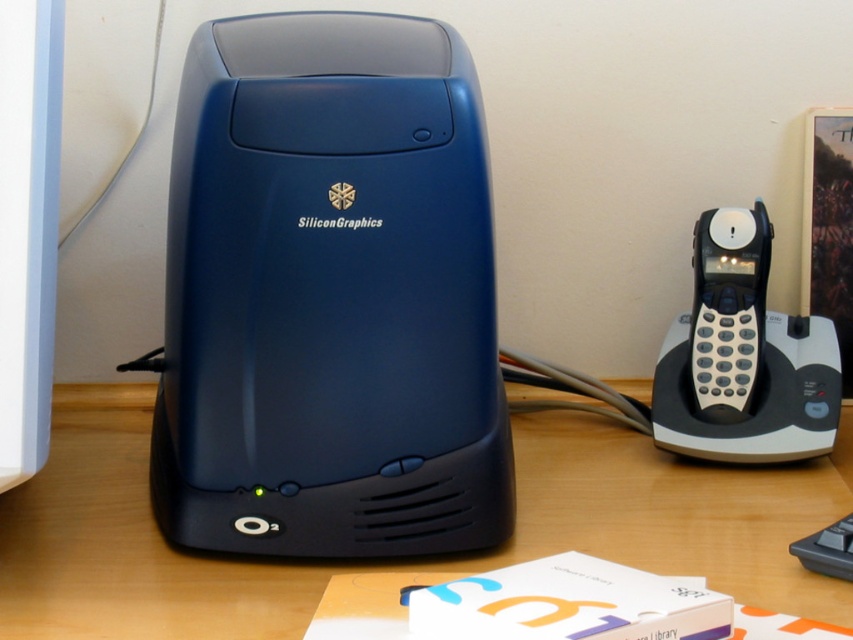
Question: Which is farther from the black plastic phone at right?

Choices:
 (A) matte blue desktop computer at center
 (B) matte black table at center

Answer: (A)

Question: Which object appears farthest from the camera in this image?

Choices:
 (A) black plastic phone at right
 (B) matte black table at center

Answer: (A)

Question: Can you confirm if matte blue desktop computer at center is thinner than black plastic phone at right?

Choices:
 (A) yes
 (B) no

Answer: (B)

Question: Considering the real-world distances, which object is farthest from the matte black table at center?

Choices:
 (A) matte blue desktop computer at center
 (B) black plastic phone at right

Answer: (B)

Question: Is matte blue desktop computer at center positioned behind matte black table at center?

Choices:
 (A) yes
 (B) no

Answer: (A)

Question: Is matte blue desktop computer at center smaller than matte black table at center?

Choices:
 (A) yes
 (B) no

Answer: (A)